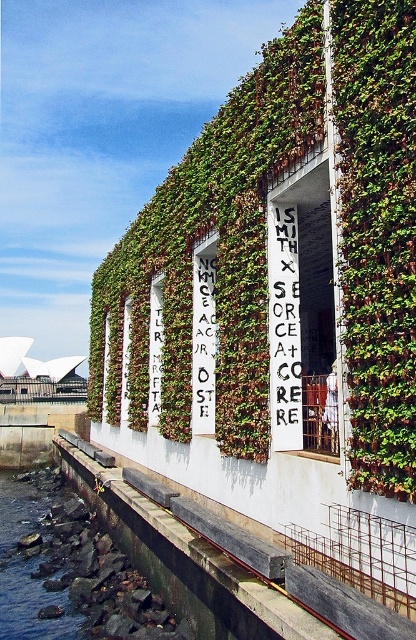
You are standing in front of the wall with greenery and text strips. There is a rocky stone waterway at lower left. Can you see the point at coordinates (31, 561) from your current position?

Yes, the point at coordinates (31, 561) corresponds to the rocky stone waterway at lower left, so it is visible from your current position.

You are standing in front of a modern building with a green wall covered in ivy. You notice two points marked on the wall. The first point is at coordinates point (x=12, y=541) and the second point is at point (x=287, y=289). Which point is closer to you?

Point (x=12, y=541) is closer to you because it is further to the viewer than point (x=287, y=289).